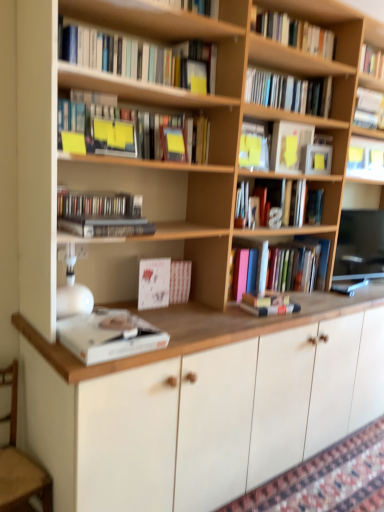
This screenshot has height=512, width=384. What are the coordinates of `vacant area that lies between white matte book at lower left, which is the twelfth book in top-to-bottom order, and hardcover book at center, which is counted as the 2th book, starting from the bottom` in the screenshot? It's located at (211, 321).